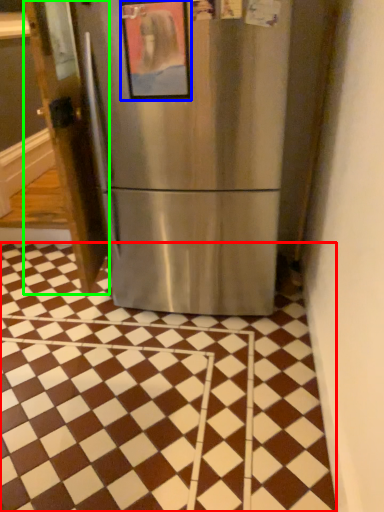
Question: Which is nearer to the tile (highlighted by a red box)? picture frame (highlighted by a blue box) or door (highlighted by a green box).

Choices:
 (A) picture frame
 (B) door

Answer: (B)